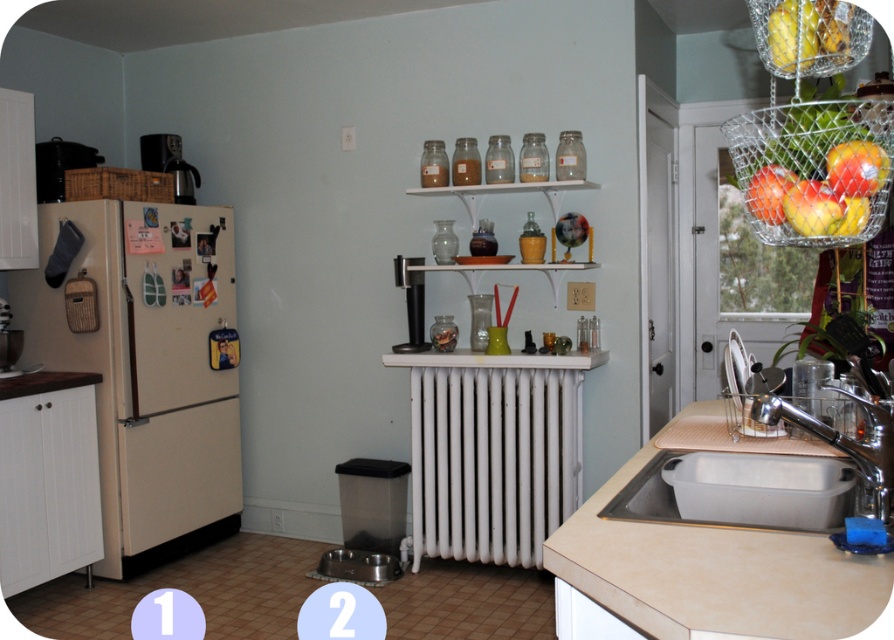
You are organizing items in the kitchen and need to place the yellow matte apple at upper right and the black plastic coffee maker at center. According to the image, which item is located higher up?

The yellow matte apple at upper right is positioned over the black plastic coffee maker at center, so it is higher up.

You are standing in the kitchen and want to wash the red matte apple at upper right. Which object should you use first, the beige laminate sink at lower right or the cream colored refrigerator on the left?

You should use the beige laminate sink at lower right first because it is in front of the red matte apple at upper right, making it more accessible.

You are organizing a kitchen cleanup. You have a beige laminate sink at lower right and a red matte apple at upper right. Which object requires more space to clean thoroughly?

The beige laminate sink at lower right requires more space to clean thoroughly because it is larger in size than the red matte apple at upper right.